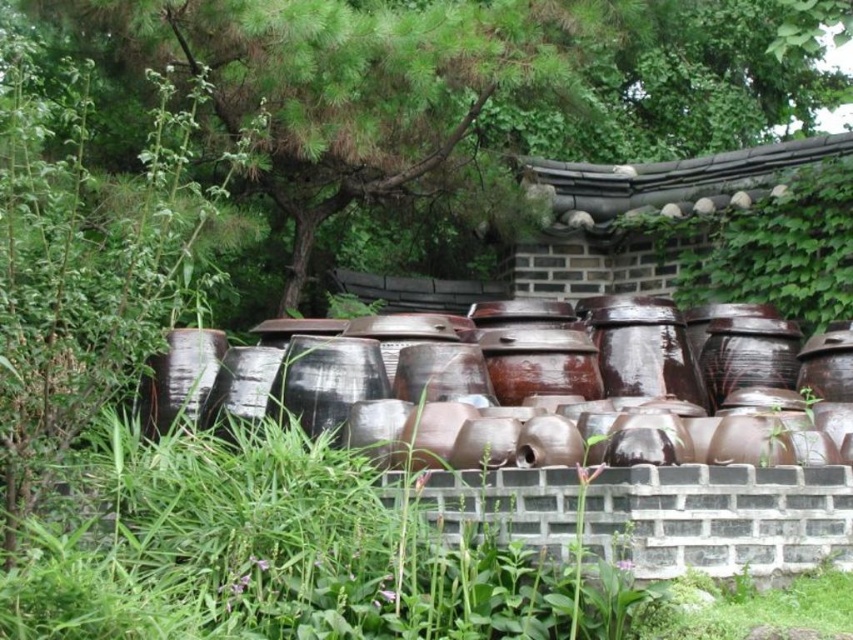
You are standing in front of the traditional Korean wall with the earthenware pots. There are two points marked on the ground in front of you. The first point is at coordinate point (350, 180) and the second is at point (349, 368). If you face the wall, which point is closer to the wall?

Point (350, 180) is behind point (349, 368), so when facing the wall, point (350, 180) is closer to the wall.

You are standing in front of the traditional Korean setting and want to take a photo of the green leafy tree at upper center. Where should you position yourself to capture it in the frame?

The green leafy tree at upper center is located at point [451,84], so you should position yourself to the left side of the scene to capture it in the frame.

You are a visitor standing in front of the traditional Korean wall and see the green leafy tree at upper center and the brown glazed pottery at center. Which object is taller?

The green leafy tree at upper center is taller than the brown glazed pottery at center.